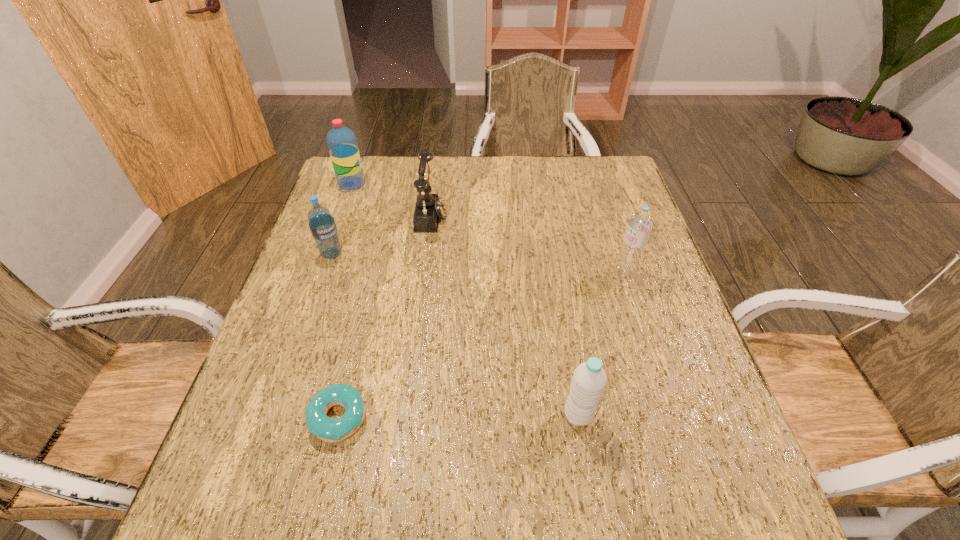
Where is `vacant area between the farthest object and the second farthest object`? The image size is (960, 540). vacant area between the farthest object and the second farthest object is located at coordinates (392, 199).

Image resolution: width=960 pixels, height=540 pixels. Find the location of `vacant area that lies between the third water bottle from left to right and the third nearest water bottle`. vacant area that lies between the third water bottle from left to right and the third nearest water bottle is located at coordinates (455, 334).

Locate an element on the screen. The width and height of the screenshot is (960, 540). free space between the fifth nearest object and the fourth nearest object is located at coordinates (381, 234).

The width and height of the screenshot is (960, 540). Identify the location of free space between the farthest object and the nearest water bottle. (465, 299).

This screenshot has height=540, width=960. I want to click on free space that is in between the farthest water bottle and the rightmost object, so click(x=489, y=228).

The width and height of the screenshot is (960, 540). In order to click on vacant space in between the telephone and the third object from left to right in this screenshot , I will do `click(385, 316)`.

Locate an element on the screen. vacant area between the second farthest object and the fourth nearest object is located at coordinates (381, 234).

You are a GUI agent. You are given a task and a screenshot of the screen. Output one action in this format:
    pyautogui.click(x=<x>, y=<y>)
    Task: Click on the vacant region between the third farthest water bottle and the second farthest water bottle
    The height and width of the screenshot is (540, 960).
    Given the screenshot: What is the action you would take?
    pyautogui.click(x=478, y=264)

The image size is (960, 540). Find the location of `object that is the fourth closest to the nearest water bottle`. object that is the fourth closest to the nearest water bottle is located at coordinates [x=322, y=225].

Image resolution: width=960 pixels, height=540 pixels. Identify the location of the fourth closest object to the rightmost object. (322, 225).